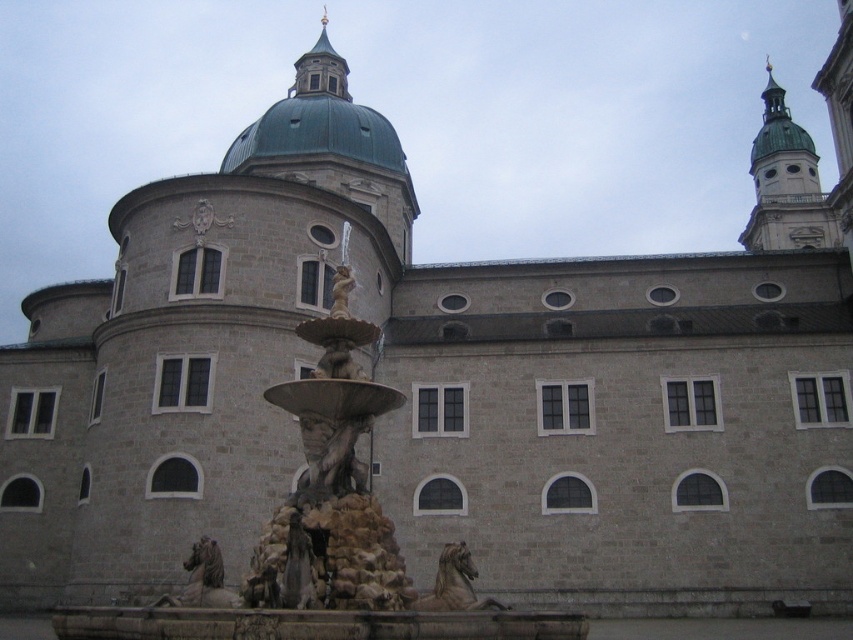
You are standing in front of the grand building and notice two points marked on the dome. The first point is located at coordinates point (345, 570) and the second at point (334, 276). Which of these two points is nearer to your current position?

Point (345, 570) is closer to the camera than point (334, 276), so the first point is nearer to your current position.

You are an architect visiting this historical building and want to place a new statue in the courtyard. The statue you have is exactly the same size as the polished bronze horse at lower center. Will it fit in the space currently occupied by the stone sculpture fountain at center?

The stone sculpture fountain at center is bigger than the polished bronze horse at lower center. Since the new statue is the same size as the polished bronze horse at lower center, it will fit in the space currently occupied by the stone sculpture fountain at center because the existing space is larger.

You are standing in front of the grand building and want to take a photo of both the stone sculpture fountain at center and the polished bronze horse at lower center. Which object should you focus on first to ensure both are in the frame?

You should focus on the stone sculpture fountain at center first since it is closer to the viewer than the polished bronze horse at lower center, ensuring both are in the frame by adjusting the camera angle accordingly.